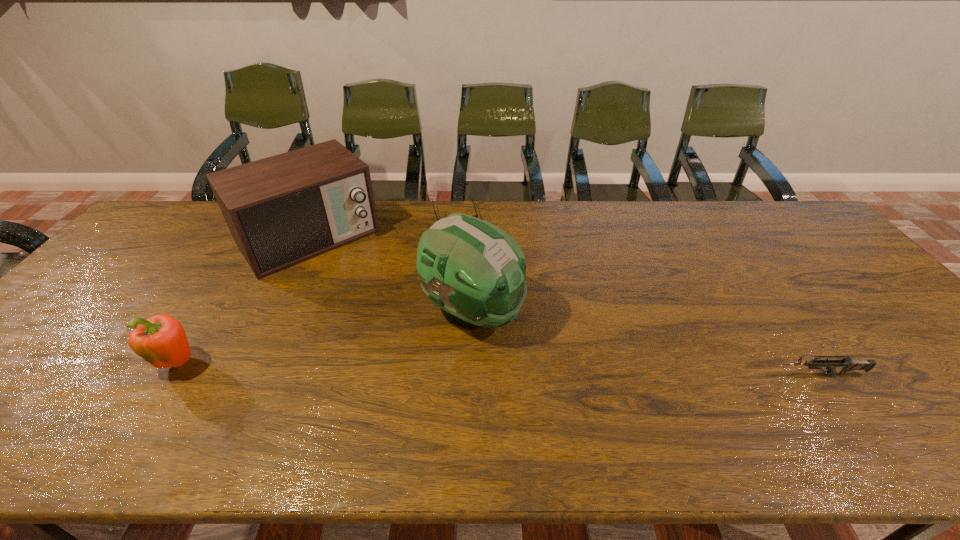
Where is `vacant spot on the desktop that is between the third shortest object and the gun and is positioned on the visor of the football helmet`? The height and width of the screenshot is (540, 960). vacant spot on the desktop that is between the third shortest object and the gun and is positioned on the visor of the football helmet is located at coordinates (577, 370).

Identify the location of vacant space on the desktop that is between the third shortest object and the rightmost object and is positioned on the front-facing side of the sunglasses. (503, 369).

Find the location of a particular element. free space on the desktop that is between the pepper and the gun and is positioned on the front-facing side of the radio receiver is located at coordinates (418, 367).